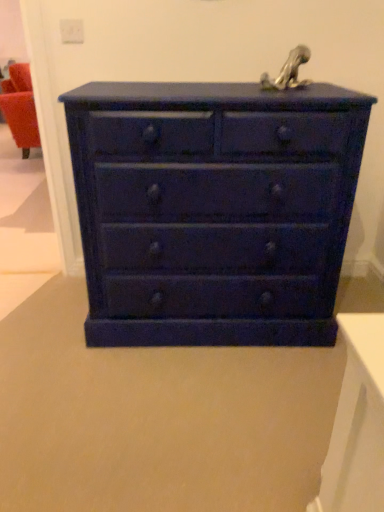
Question: Should I look upward or downward to see matte blue chest of drawers at center?

Choices:
 (A) down
 (B) up

Answer: (B)